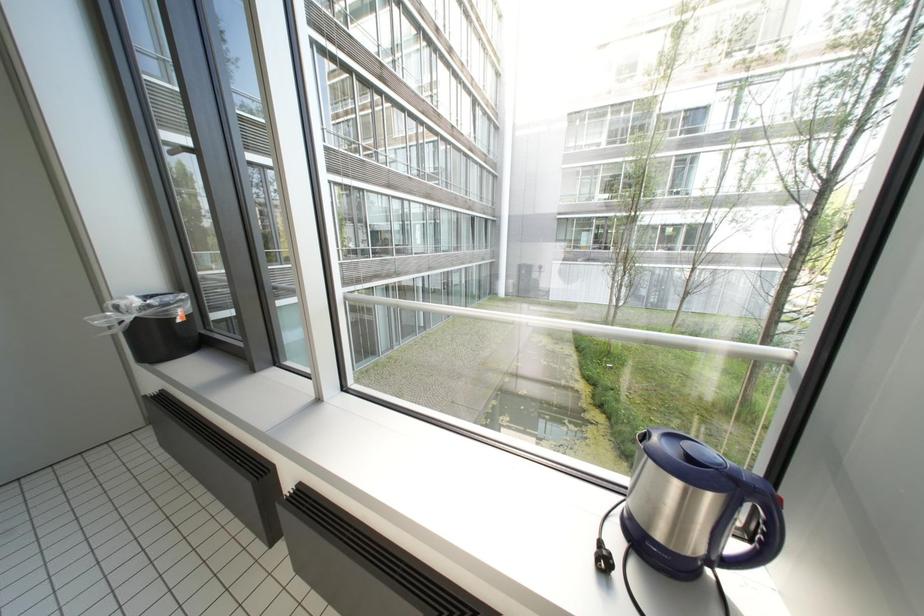
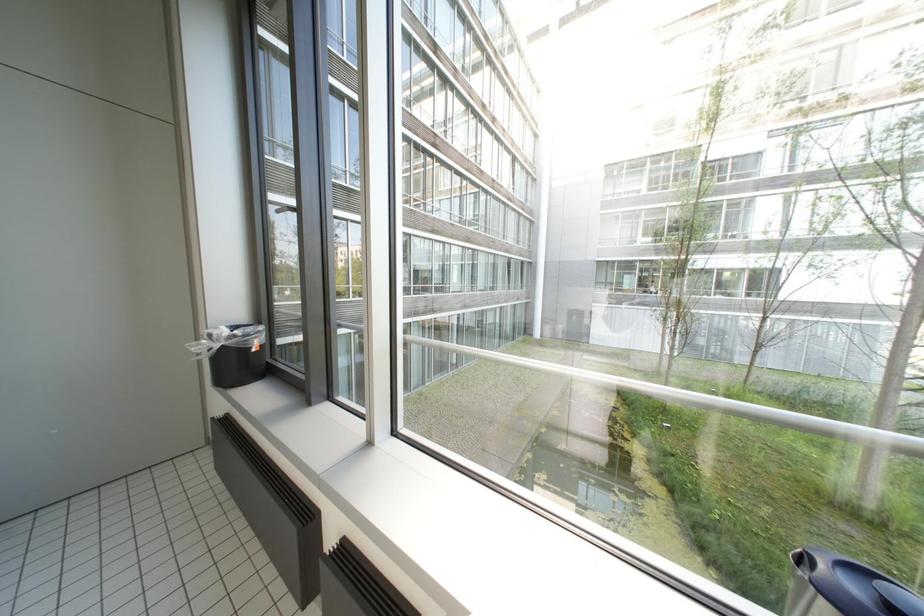
Question: How did the camera likely rotate?

Choices:
 (A) Left
 (B) Right
 (C) Up
 (D) Down

Answer: (C)